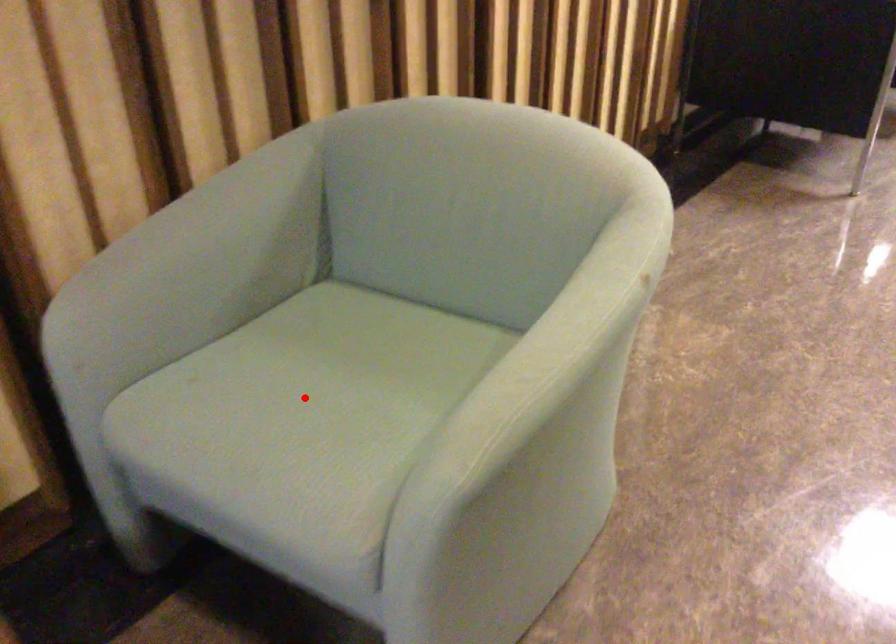
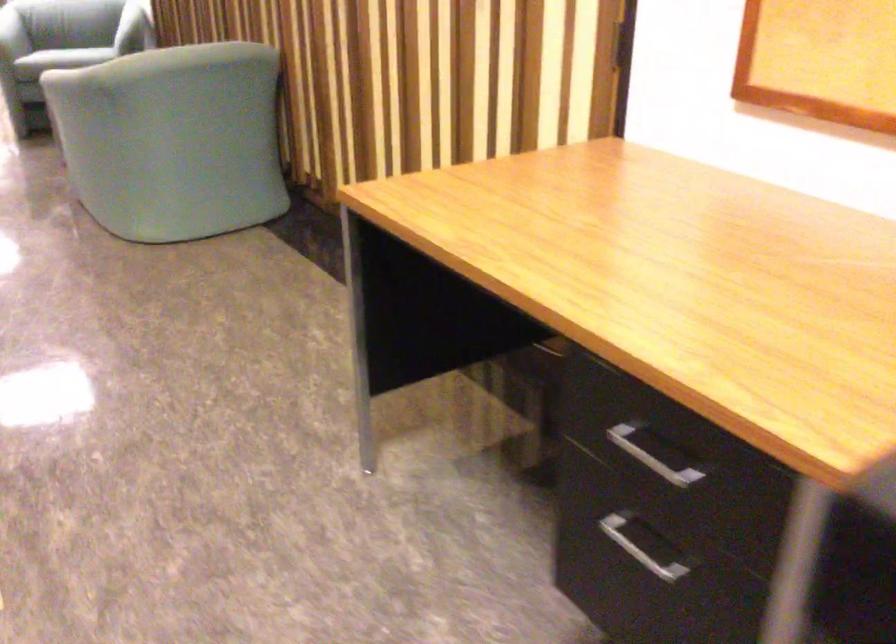
Question: I am providing you with two images of the same scene from different viewpoints. A red point is marked on the first image. Is the red point's position out of view in image 2?

Choices:
 (A) Yes
 (B) No

Answer: (A)